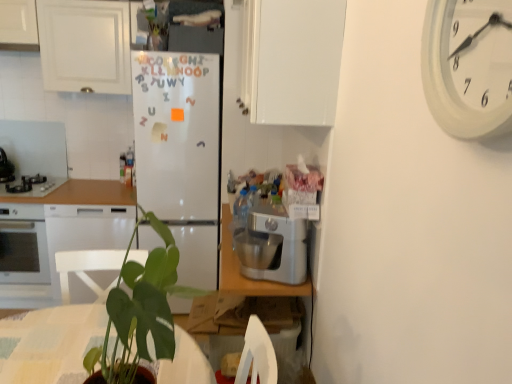
In order to click on green matte plant at center in this screenshot , I will do `click(141, 312)`.

The height and width of the screenshot is (384, 512). I want to click on wooden countertop at left, so click(x=72, y=230).

You are a GUI agent. You are given a task and a screenshot of the screen. Output one action in this format:
    pyautogui.click(x=<x>, y=<y>)
    Task: Click on the silver metallic stand mixer at center
    The image size is (512, 384).
    Given the screenshot: What is the action you would take?
    pyautogui.click(x=272, y=246)

Measure the distance between point (280,255) and camera.

The depth of point (280,255) is 5.83 feet.

Image resolution: width=512 pixels, height=384 pixels. I want to click on white matte cabinet at upper right, marked as the second cabinetry in a left-to-right arrangement, so click(x=298, y=61).

The height and width of the screenshot is (384, 512). I want to click on green matte plant at center, so click(x=141, y=312).

Could you tell me if white plastic clock at upper right is turned towards green matte plant at center?

No, white plastic clock at upper right is not turned towards green matte plant at center.

Can you confirm if white plastic clock at upper right is taller than green matte plant at center?

Incorrect, the height of white plastic clock at upper right is not larger of that of green matte plant at center.

Looking at this image, is white plastic clock at upper right far away from green matte plant at center?

white plastic clock at upper right is near green matte plant at center, not far away.

In the image, is white plastic clock at upper right positioned in front of or behind green matte plant at center?

Clearly, white plastic clock at upper right is in front of green matte plant at center.

Which of these two, white matte refrigerator at center or silver metallic stand mixer at center, is smaller?

Smaller between the two is silver metallic stand mixer at center.

Is silver metallic stand mixer at center at the back of white matte refrigerator at center?

white matte refrigerator at center is not turned away from silver metallic stand mixer at center.

At what (x,y) coordinates should I click in order to perform the action: click on kitchen appliance to the right of white matte refrigerator at center. Please return your answer as a coordinate pair (x, y). The height and width of the screenshot is (384, 512). Looking at the image, I should click on [x=272, y=246].

Considering the sizes of objects brushed metal stove at left, marked as the second appliance in a bottom-to-top arrangement, and wooden countertop at left in the image provided, who is thinner, brushed metal stove at left, marked as the second appliance in a bottom-to-top arrangement, or wooden countertop at left?

With smaller width is brushed metal stove at left, marked as the second appliance in a bottom-to-top arrangement.

Does point (2, 155) lie behind point (112, 201)?

Yes, it is behind point (112, 201).

From the image's perspective, does brushed metal stove at left, marked as the second appliance in a bottom-to-top arrangement, appear lower than wooden countertop at left?

No, from the image's perspective, brushed metal stove at left, marked as the second appliance in a bottom-to-top arrangement, is not beneath wooden countertop at left.

From a real-world perspective, is brushed metal stove at left, marked as the second appliance in a bottom-to-top arrangement, on wooden countertop at left?

Correct, in the physical world, brushed metal stove at left, marked as the second appliance in a bottom-to-top arrangement, is higher than wooden countertop at left.

Is black glass cooktop at left, the second appliance in the top-to-bottom sequence, taller or shorter than green matte plant at center?

In the image, black glass cooktop at left, the second appliance in the top-to-bottom sequence, appears to be shorter than green matte plant at center.

How many degrees apart are the facing directions of black glass cooktop at left, arranged as the 1th appliance when ordered from the bottom, and green matte plant at center?

The angle between the facing direction of black glass cooktop at left, arranged as the 1th appliance when ordered from the bottom, and the facing direction of green matte plant at center is 87.7 degrees.

Which of these two, black glass cooktop at left, the second appliance in the top-to-bottom sequence, or green matte plant at center, is wider?

black glass cooktop at left, the second appliance in the top-to-bottom sequence, is wider.

You are a GUI agent. You are given a task and a screenshot of the screen. Output one action in this format:
    pyautogui.click(x=<x>, y=<y>)
    Task: Click on the houseplant below the black glass cooktop at left, arranged as the 1th appliance when ordered from the bottom (from the image's perspective)
    This screenshot has height=384, width=512.
    Given the screenshot: What is the action you would take?
    pyautogui.click(x=141, y=312)

Is white glossy cabinet at upper left, acting as the 1th cabinetry starting from the left, surrounding white matte refrigerator at center?

Actually, white matte refrigerator at center is outside white glossy cabinet at upper left, acting as the 1th cabinetry starting from the left.

Looking at this image, considering the positions of objects white glossy cabinet at upper left, which is the second cabinetry in right-to-left order, and white matte refrigerator at center in the image provided, who is behind, white glossy cabinet at upper left, which is the second cabinetry in right-to-left order, or white matte refrigerator at center?

white glossy cabinet at upper left, which is the second cabinetry in right-to-left order, is behind.

From the image's perspective, which one is positioned higher, white glossy cabinet at upper left, the first cabinetry when ordered from back to front, or white matte refrigerator at center?

white glossy cabinet at upper left, the first cabinetry when ordered from back to front.

Can you tell me how much white glossy cabinet at upper left, acting as the 1th cabinetry starting from the left, and white matte refrigerator at center differ in facing direction?

There is a 0.262-degree angle between the facing directions of white glossy cabinet at upper left, acting as the 1th cabinetry starting from the left, and white matte refrigerator at center.

Is white matte refrigerator at center to the left or to the right of wooden countertop at left in the image?

white matte refrigerator at center is positioned on wooden countertop at left's right side.

Is wooden countertop at left completely or partially inside white matte refrigerator at center?

Answer: No, wooden countertop at left is not inside white matte refrigerator at center.

Which object is closer to the camera taking this photo, white matte refrigerator at center or wooden countertop at left?

Positioned in front is white matte refrigerator at center.

Considering the relative sizes of white matte refrigerator at center and wooden countertop at left in the image provided, is white matte refrigerator at center smaller than wooden countertop at left?

No.

Find the location of a particular element. appliance lying below the brushed metal stove at left, the first appliance when ordered from top to bottom (from the image's perspective) is located at coordinates (37, 188).

Considering the relative sizes of black glass cooktop at left, the second appliance in the top-to-bottom sequence, and brushed metal stove at left, marked as the second appliance in a bottom-to-top arrangement, in the image provided, is black glass cooktop at left, the second appliance in the top-to-bottom sequence, wider than brushed metal stove at left, marked as the second appliance in a bottom-to-top arrangement,?

Indeed, black glass cooktop at left, the second appliance in the top-to-bottom sequence, has a greater width compared to brushed metal stove at left, marked as the second appliance in a bottom-to-top arrangement.

Are black glass cooktop at left, arranged as the 1th appliance when ordered from the bottom, and brushed metal stove at left, the first appliance when ordered from top to bottom, beside each other?

No.

Where is `houseplant that appears behind the white plastic clock at upper right`? The height and width of the screenshot is (384, 512). houseplant that appears behind the white plastic clock at upper right is located at coordinates (141, 312).

Where is `refrigerator on the left of silver metallic stand mixer at center`? The image size is (512, 384). refrigerator on the left of silver metallic stand mixer at center is located at coordinates (180, 153).

Looking at the image, which one is located further to silver metallic stand mixer at center, white glossy cabinet at upper left, acting as the 1th cabinetry starting from the left, or wooden countertop at left?

Based on the image, white glossy cabinet at upper left, acting as the 1th cabinetry starting from the left, appears to be further to silver metallic stand mixer at center.

When comparing their distances from black glass cooktop at left, the second appliance in the top-to-bottom sequence, does white matte refrigerator at center or white matte cabinet at upper right, which appears as the first cabinetry when viewed from the front, seem closer?

The object closer to black glass cooktop at left, the second appliance in the top-to-bottom sequence, is white matte refrigerator at center.

From the image, which object appears to be nearer to white matte cabinet at upper right, which appears as the first cabinetry when viewed from the front, white glossy cabinet at upper left, which is the 2th cabinetry in front-to-back order, or wooden countertop at left?

Based on the image, white glossy cabinet at upper left, which is the 2th cabinetry in front-to-back order, appears to be nearer to white matte cabinet at upper right, which appears as the first cabinetry when viewed from the front.

Which object lies nearer to the anchor point green matte plant at center, wooden countertop at left or white matte refrigerator at center?

white matte refrigerator at center lies closer to green matte plant at center than the other object.

From the image, which object appears to be farther from black glass cooktop at left, arranged as the 1th appliance when ordered from the bottom, wooden countertop at left or white matte refrigerator at center?

white matte refrigerator at center.

Estimate the real-world distances between objects in this image. Which object is further from black glass cooktop at left, the second appliance in the top-to-bottom sequence, brushed metal stove at left, the first appliance when ordered from top to bottom, or white plastic clock at upper right?

Among the two, white plastic clock at upper right is located further to black glass cooktop at left, the second appliance in the top-to-bottom sequence.

From the image, which object appears to be nearer to green matte plant at center, white matte refrigerator at center or black glass cooktop at left, the second appliance in the top-to-bottom sequence?

white matte refrigerator at center is positioned closer to the anchor green matte plant at center.

Considering their positions, is white plastic clock at upper right positioned closer to black glass cooktop at left, the second appliance in the top-to-bottom sequence, than green matte plant at center?

green matte plant at center is positioned closer to the anchor black glass cooktop at left, the second appliance in the top-to-bottom sequence.

The height and width of the screenshot is (384, 512). Find the location of `houseplant between white plastic clock at upper right and white glossy cabinet at upper left, which is the second cabinetry in right-to-left order, along the z-axis`. houseplant between white plastic clock at upper right and white glossy cabinet at upper left, which is the second cabinetry in right-to-left order, along the z-axis is located at coordinates (141, 312).

Locate an element on the screen. The height and width of the screenshot is (384, 512). kitchen appliance between green matte plant at center and brushed metal stove at left, marked as the second appliance in a bottom-to-top arrangement, along the z-axis is located at coordinates (272, 246).

Find the location of a particular element. This screenshot has height=384, width=512. refrigerator located between white plastic clock at upper right and brushed metal stove at left, the first appliance when ordered from top to bottom, in the depth direction is located at coordinates (180, 153).

Find the location of `countertop between black glass cooktop at left, arranged as the 1th appliance when ordered from the bottom, and silver metallic stand mixer at center, in the horizontal direction`. countertop between black glass cooktop at left, arranged as the 1th appliance when ordered from the bottom, and silver metallic stand mixer at center, in the horizontal direction is located at coordinates (72, 230).